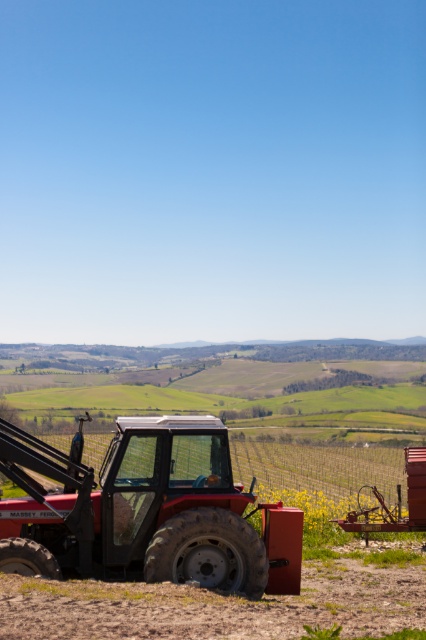
Question: Can you confirm if matte red tractor at lower left is thinner than dull brown dirt at lower right?

Choices:
 (A) yes
 (B) no

Answer: (B)

Question: Can you confirm if matte red tractor at lower left is positioned to the left of dull brown dirt at lower right?

Choices:
 (A) no
 (B) yes

Answer: (A)

Question: Is matte red tractor at lower left below dull brown dirt at lower right?

Choices:
 (A) no
 (B) yes

Answer: (A)